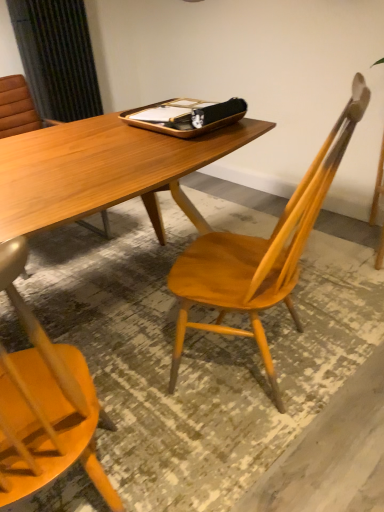
Question: Is wooden chair at center taller than wooden tray at center?

Choices:
 (A) yes
 (B) no

Answer: (A)

Question: Is wooden chair at center closer to the viewer compared to wooden tray at center?

Choices:
 (A) yes
 (B) no

Answer: (A)

Question: Does wooden chair at center have a greater width compared to wooden tray at center?

Choices:
 (A) yes
 (B) no

Answer: (A)

Question: Does wooden chair at center have a smaller size compared to wooden tray at center?

Choices:
 (A) no
 (B) yes

Answer: (A)

Question: From a real-world perspective, is wooden chair at center beneath wooden tray at center?

Choices:
 (A) no
 (B) yes

Answer: (B)

Question: Can you confirm if wooden chair at center is bigger than wooden tray at center?

Choices:
 (A) yes
 (B) no

Answer: (A)

Question: Is wooden tray at center positioned with its back to wooden chair at center?

Choices:
 (A) yes
 (B) no

Answer: (B)

Question: Considering the relative sizes of wooden tray at center and wooden chair at center in the image provided, is wooden tray at center smaller than wooden chair at center?

Choices:
 (A) no
 (B) yes

Answer: (B)

Question: Does wooden tray at center have a lesser width compared to wooden chair at center?

Choices:
 (A) no
 (B) yes

Answer: (B)

Question: Does wooden tray at center have a lesser height compared to wooden chair at center?

Choices:
 (A) yes
 (B) no

Answer: (A)

Question: From a real-world perspective, is wooden tray at center located beneath wooden chair at center?

Choices:
 (A) no
 (B) yes

Answer: (A)

Question: Is wooden chair at center located within wooden tray at center?

Choices:
 (A) yes
 (B) no

Answer: (B)

Question: From their relative heights in the image, would you say wooden tray at center is taller or shorter than wooden chair at center?

Choices:
 (A) tall
 (B) short

Answer: (B)